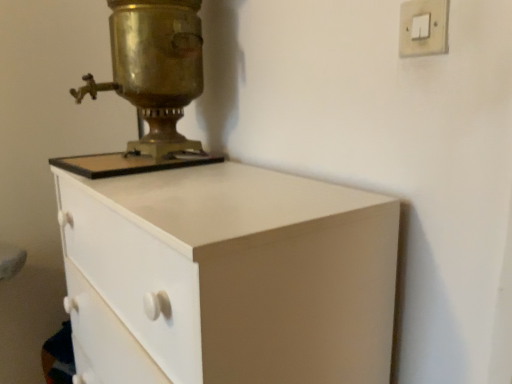
Question: Do you think white matte chest of drawers at center is within brass/bronze metallic samovar at upper left, or outside of it?

Choices:
 (A) outside
 (B) inside

Answer: (A)

Question: Is point (222, 332) closer or farther from the camera than point (140, 114)?

Choices:
 (A) farther
 (B) closer

Answer: (B)

Question: Which of these objects is positioned closest to the white matte chest of drawers at center?

Choices:
 (A) gold metallic light switch at upper right
 (B) brass/bronze metallic samovar at upper left

Answer: (B)

Question: Based on their relative distances, which object is farther from the gold metallic light switch at upper right?

Choices:
 (A) brass/bronze metallic samovar at upper left
 (B) white matte chest of drawers at center

Answer: (A)